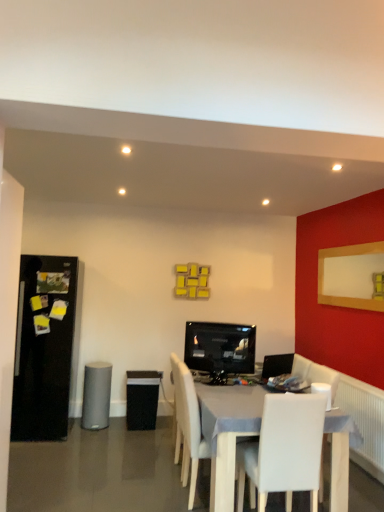
At what (x,y) coordinates should I click in order to perform the action: click on free space that is in between gray matte speaker at lower left, placed as the 3th speaker when sorted from right to left, and black glossy refrigerator at left. Please return your answer as a coordinate pair (x, y). This screenshot has height=512, width=384. Looking at the image, I should click on pos(92,432).